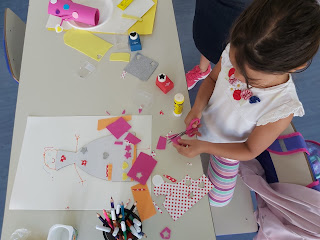
Image resolution: width=320 pixels, height=240 pixels. Find the location of `table`. table is located at coordinates click(x=63, y=70).